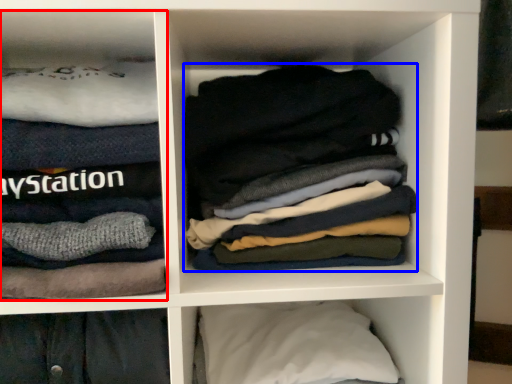
Question: Which object appears farthest to the camera in this image, cabinet (highlighted by a red box) or laundry (highlighted by a blue box)?

Choices:
 (A) cabinet
 (B) laundry

Answer: (B)